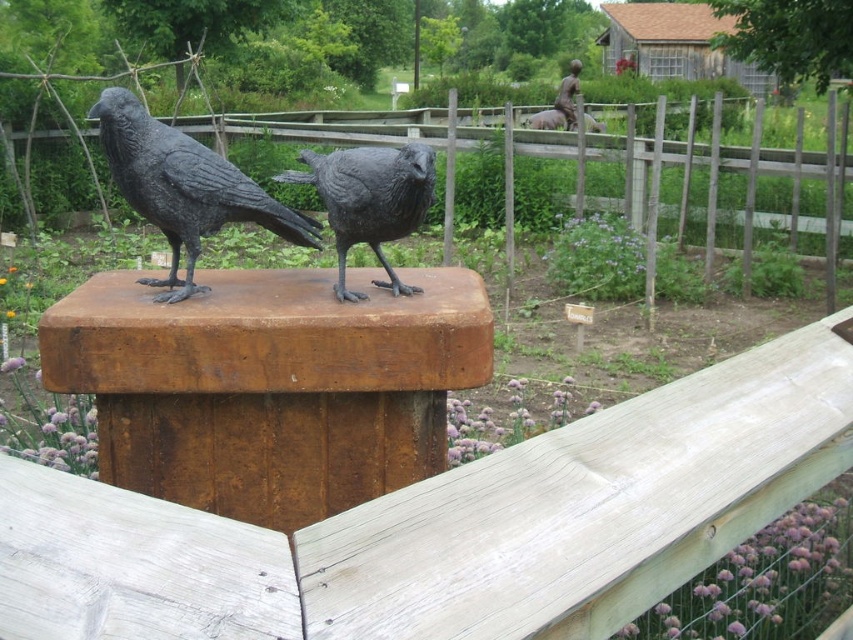
Consider the image. Who is shorter, shiny black raven at center or bronze statue at upper center?

Standing shorter between the two is shiny black raven at center.

Does shiny black raven at center have a lesser height compared to bronze statue at upper center?

Correct, shiny black raven at center is not as tall as bronze statue at upper center.

This screenshot has width=853, height=640. Describe the element at coordinates (184, 188) in the screenshot. I see `shiny black raven at center` at that location.

Locate an element on the screen. The height and width of the screenshot is (640, 853). shiny black raven at center is located at coordinates (184, 188).

Between matte black crow at center and bronze statue at upper center, which one appears on the right side from the viewer's perspective?

bronze statue at upper center is more to the right.

Does matte black crow at center have a greater width compared to bronze statue at upper center?

In fact, matte black crow at center might be narrower than bronze statue at upper center.

You are a GUI agent. You are given a task and a screenshot of the screen. Output one action in this format:
    pyautogui.click(x=<x>, y=<y>)
    Task: Click on the matte black crow at center
    
    Given the screenshot: What is the action you would take?
    pyautogui.click(x=369, y=200)

Is point (276, 225) farther from camera compared to point (422, 198)?

Yes.

What do you see at coordinates (184, 188) in the screenshot? I see `shiny black raven at center` at bounding box center [184, 188].

Where is `shiny black raven at center`? The image size is (853, 640). shiny black raven at center is located at coordinates (184, 188).